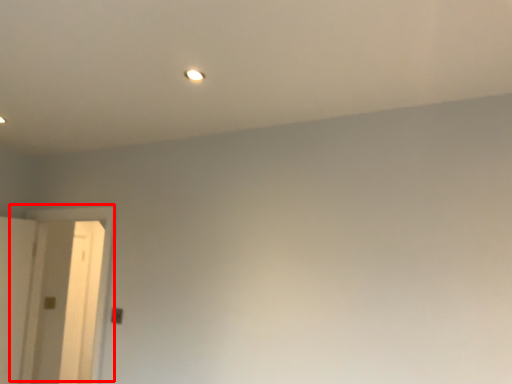
Question: From the image's perspective, where is door (annotated by the red box) located relative to light?

Choices:
 (A) below
 (B) above

Answer: (A)